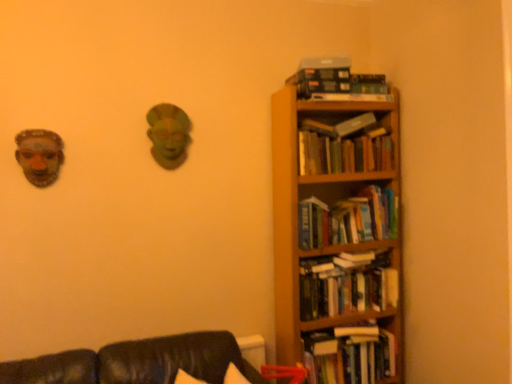
You are a GUI agent. You are given a task and a screenshot of the screen. Output one action in this format:
    pyautogui.click(x=<x>, y=<y>)
    Task: Click on the hardcover books at upper right, which is counted as the 5th book, starting from the bottom
    
    Given the screenshot: What is the action you would take?
    pyautogui.click(x=339, y=85)

In order to face hardcover book at upper right, should I rotate leftwards or rightwards?

To align with it, rotate right about 13.429°.

You are a GUI agent. You are given a task and a screenshot of the screen. Output one action in this format:
    pyautogui.click(x=<x>, y=<y>)
    Task: Click on the hardcover books at right, the 2th book positioned from the top
    The width and height of the screenshot is (512, 384).
    Given the screenshot: What is the action you would take?
    pyautogui.click(x=344, y=148)

Describe the element at coordinates (344, 148) in the screenshot. The width and height of the screenshot is (512, 384). I see `hardcover books at right, the 2th book positioned from the top` at that location.

Where is `hardcover books at right, acting as the fourth book starting from the top`? The width and height of the screenshot is (512, 384). hardcover books at right, acting as the fourth book starting from the top is located at coordinates (347, 284).

What is the approximate height of wooden bookcase at right?

wooden bookcase at right is 1.77 meters tall.

Measure the distance between point (349,360) and camera.

They are 2.26 meters apart.

This screenshot has height=384, width=512. Describe the element at coordinates (349, 219) in the screenshot. I see `hardcover books at right, which is the third book from bottom to top` at that location.

How much space does hardcover books at right, placed as the first book when sorted from bottom to top, occupy vertically?

The height of hardcover books at right, placed as the first book when sorted from bottom to top, is 10.67 inches.

Locate an element on the screen. hardcover books at upper right, which is the first book in top-to-bottom order is located at coordinates (339, 85).

Which object is thinner, hardcover books at right, placed as the first book when sorted from bottom to top, or hardcover books at right, the third book positioned from the top?

With smaller width is hardcover books at right, the third book positioned from the top.

Is hardcover books at right, the 5th book from the top, facing away from hardcover books at right, which is the third book from bottom to top?

No, hardcover books at right, the 5th book from the top, is not facing the opposite direction of hardcover books at right, which is the third book from bottom to top.

Who is more distant, hardcover books at right, placed as the first book when sorted from bottom to top, or hardcover books at right, the third book positioned from the top?

hardcover books at right, the third book positioned from the top.

Locate an element on the screen. The height and width of the screenshot is (384, 512). human face above the hardcover books at right, marked as the 4th book in a bottom-to-top arrangement (from a real-world perspective) is located at coordinates (39, 158).

Between matte brown mask at left and hardcover books at right, marked as the 4th book in a bottom-to-top arrangement, which one has smaller width?

With smaller width is matte brown mask at left.

From a real-world perspective, which is physically below, matte brown mask at left or hardcover books at right, marked as the 4th book in a bottom-to-top arrangement?

hardcover books at right, marked as the 4th book in a bottom-to-top arrangement, is physically lower.

Does point (41, 167) come in front of point (367, 140)?

That is True.

Can you confirm if hardcover books at right, acting as the fourth book starting from the top, is thinner than hardcover book at upper right?

In fact, hardcover books at right, acting as the fourth book starting from the top, might be wider than hardcover book at upper right.

Considering the relative positions of hardcover books at right, which appears as the 2th book when ordered from the bottom, and hardcover book at upper right in the image provided, is hardcover books at right, which appears as the 2th book when ordered from the bottom, behind hardcover book at upper right?

No, hardcover books at right, which appears as the 2th book when ordered from the bottom, is closer to the viewer.

Can we say hardcover books at right, which appears as the 2th book when ordered from the bottom, lies outside hardcover book at upper right?

Indeed, hardcover books at right, which appears as the 2th book when ordered from the bottom, is completely outside hardcover book at upper right.

From the hardcover book at upper right, count 5th books forward and point to it. Please provide its 2D coordinates.

[(347, 284)]

Considering the sizes of objects hardcover book at upper right and hardcover books at right, marked as the 4th book in a bottom-to-top arrangement, in the image provided, who is wider, hardcover book at upper right or hardcover books at right, marked as the 4th book in a bottom-to-top arrangement,?

hardcover books at right, marked as the 4th book in a bottom-to-top arrangement.

Does hardcover book at upper right have a lesser height compared to hardcover books at right, marked as the 4th book in a bottom-to-top arrangement?

Indeed, hardcover book at upper right has a lesser height compared to hardcover books at right, marked as the 4th book in a bottom-to-top arrangement.

Is hardcover book at upper right next to hardcover books at right, marked as the 4th book in a bottom-to-top arrangement, and touching it?

No, hardcover book at upper right is not touching hardcover books at right, marked as the 4th book in a bottom-to-top arrangement.

From the image's perspective, is hardcover book at upper right below hardcover books at right, the 2th book positioned from the top?

No, from the image's perspective, hardcover book at upper right is not below hardcover books at right, the 2th book positioned from the top.

Which object is positioned more to the left, hardcover books at right, placed as the first book when sorted from bottom to top, or wooden bookcase at right?

Positioned to the left is wooden bookcase at right.

From the image's perspective, relative to wooden bookcase at right, is hardcover books at right, the 5th book from the top, above or below?

From the image's perspective, hardcover books at right, the 5th book from the top, appears below wooden bookcase at right.

Considering the sizes of hardcover books at right, the 5th book from the top, and wooden bookcase at right in the image, is hardcover books at right, the 5th book from the top, taller or shorter than wooden bookcase at right?

Considering their sizes, hardcover books at right, the 5th book from the top, has less height than wooden bookcase at right.

Considering the positions of objects hardcover books at right, placed as the first book when sorted from bottom to top, and wooden bookcase at right in the image provided, who is in front, hardcover books at right, placed as the first book when sorted from bottom to top, or wooden bookcase at right?

hardcover books at right, placed as the first book when sorted from bottom to top.

You are a GUI agent. You are given a task and a screenshot of the screen. Output one action in this format:
    pyautogui.click(x=<x>, y=<y>)
    Task: Click on the book that is the 1st object to the left of the hardcover books at right, the third book positioned from the top, starting at the anchor
    This screenshot has width=512, height=384.
    Given the screenshot: What is the action you would take?
    pyautogui.click(x=339, y=85)

Which point is more forward, (348,241) or (344,72)?

The point (348,241) is more forward.

From the image's perspective, which one is positioned higher, hardcover books at right, the third book positioned from the top, or hardcover books at upper right, which is counted as the 5th book, starting from the bottom?

hardcover books at upper right, which is counted as the 5th book, starting from the bottom, from the image's perspective.

Would you say hardcover books at right, the third book positioned from the top, is outside hardcover books at upper right, which is the first book in top-to-bottom order?

Absolutely, hardcover books at right, the third book positioned from the top, is external to hardcover books at upper right, which is the first book in top-to-bottom order.

Is hardcover book at upper right thinner than hardcover books at right, placed as the first book when sorted from bottom to top?

Indeed, hardcover book at upper right has a lesser width compared to hardcover books at right, placed as the first book when sorted from bottom to top.

Consider the image. Measure the distance between hardcover book at upper right and hardcover books at right, the 5th book from the top.

They are 1.17 meters apart.

How many degrees apart are the facing directions of hardcover book at upper right and hardcover books at right, placed as the first book when sorted from bottom to top?

The facing directions of hardcover book at upper right and hardcover books at right, placed as the first book when sorted from bottom to top, are 2.41 degrees apart.

From the picture: Is hardcover book at upper right smaller than hardcover books at right, the 5th book from the top?

Yes, hardcover book at upper right is smaller than hardcover books at right, the 5th book from the top.

You are a GUI agent. You are given a task and a screenshot of the screen. Output one action in this format:
    pyautogui.click(x=<x>, y=<y>)
    Task: Click on the book that is the 1st object located in front of the hardcover books at right, the third book positioned from the top
    
    Given the screenshot: What is the action you would take?
    pyautogui.click(x=350, y=354)

The height and width of the screenshot is (384, 512). In order to click on book that is the 1st one when counting upward from the matte brown mask at left (from the image's perspective) in this screenshot , I will do `click(344, 148)`.

Considering their positions, is hardcover books at right, the 5th book from the top, positioned closer to hardcover book at upper right than hardcover books at right, which is the third book from bottom to top?

Based on the image, hardcover books at right, which is the third book from bottom to top, appears to be nearer to hardcover book at upper right.

Considering their positions, is hardcover books at right, placed as the first book when sorted from bottom to top, positioned further to hardcover books at upper right, which is the first book in top-to-bottom order, than matte brown mask at left?

Among the two, matte brown mask at left is located further to hardcover books at upper right, which is the first book in top-to-bottom order.

Considering their positions, is hardcover books at right, the 5th book from the top, positioned further to hardcover books at upper right, which is the first book in top-to-bottom order, than wooden bookcase at right?

hardcover books at right, the 5th book from the top, is positioned further to the anchor hardcover books at upper right, which is the first book in top-to-bottom order.

From the image, which object appears to be nearer to hardcover books at right, the 2th book positioned from the top, hardcover books at right, acting as the fourth book starting from the top, or hardcover books at upper right, which is the first book in top-to-bottom order?

hardcover books at upper right, which is the first book in top-to-bottom order.

Considering their positions, is wooden bookcase at right positioned further to hardcover books at upper right, which is the first book in top-to-bottom order, than hardcover books at right, which appears as the 2th book when ordered from the bottom?

Based on the image, hardcover books at right, which appears as the 2th book when ordered from the bottom, appears to be further to hardcover books at upper right, which is the first book in top-to-bottom order.

Looking at the image, which one is located further to hardcover books at right, which is the third book from bottom to top, wooden bookcase at right or matte brown mask at left?

matte brown mask at left lies further to hardcover books at right, which is the third book from bottom to top, than the other object.

Which object lies nearer to the anchor point wooden bookcase at right, hardcover books at right, the 2th book positioned from the top, or matte brown mask at left?

hardcover books at right, the 2th book positioned from the top.

Estimate the real-world distances between objects in this image. Which object is further from hardcover books at right, marked as the 4th book in a bottom-to-top arrangement, matte brown mask at left or hardcover books at right, which is the third book from bottom to top?

matte brown mask at left lies further to hardcover books at right, marked as the 4th book in a bottom-to-top arrangement, than the other object.

The height and width of the screenshot is (384, 512). Identify the location of bookcase situated between matte brown mask at left and hardcover books at right, placed as the first book when sorted from bottom to top, from left to right. (337, 240).

Locate an element on the screen. book that lies between hardcover books at right, the 2th book positioned from the top, and wooden bookcase at right from top to bottom is located at coordinates [349, 219].

Where is `bookcase between hardcover books at upper right, which is the first book in top-to-bottom order, and hardcover books at right, the 5th book from the top, from top to bottom`? bookcase between hardcover books at upper right, which is the first book in top-to-bottom order, and hardcover books at right, the 5th book from the top, from top to bottom is located at coordinates (337, 240).

Locate an element on the screen. The width and height of the screenshot is (512, 384). bookcase between hardcover book at upper right and hardcover books at right, acting as the fourth book starting from the top, from top to bottom is located at coordinates (337, 240).